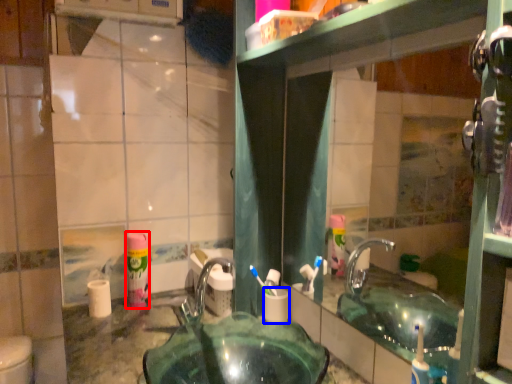
Question: Which object is further to the camera taking this photo, mouthwash (highlighted by a red box) or toilet paper (highlighted by a blue box)?

Choices:
 (A) mouthwash
 (B) toilet paper

Answer: (A)